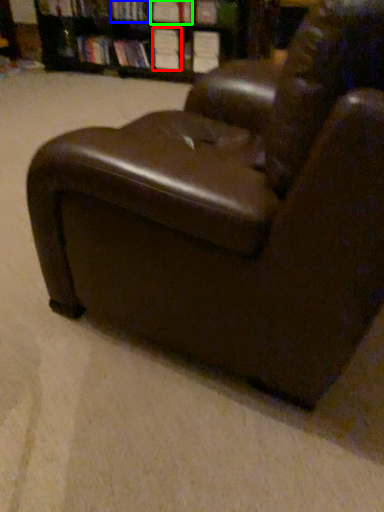
Question: Estimate the real-world distances between objects in this image. Which object is farther from book (highlighted by a red box), book (highlighted by a blue box) or book (highlighted by a green box)?

Choices:
 (A) book
 (B) book

Answer: (A)